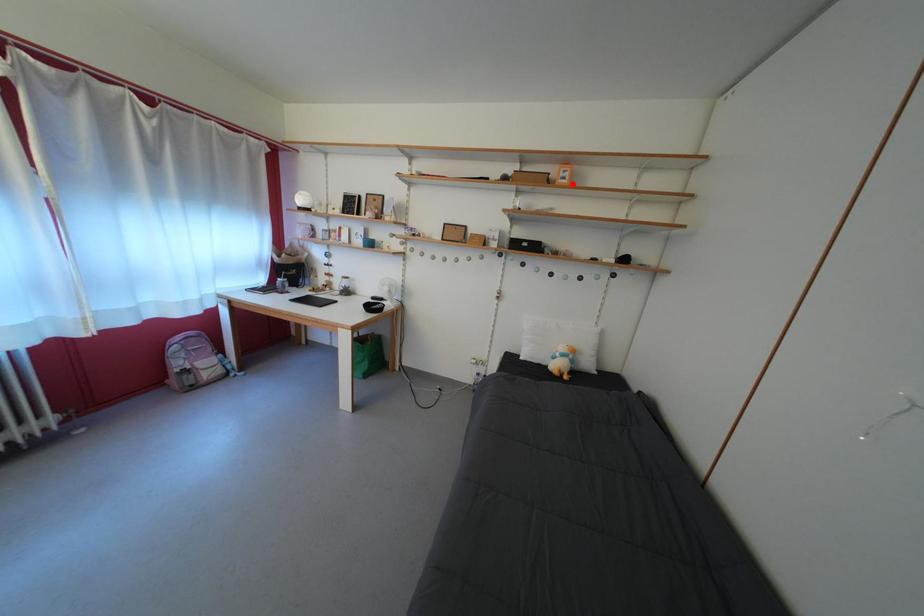
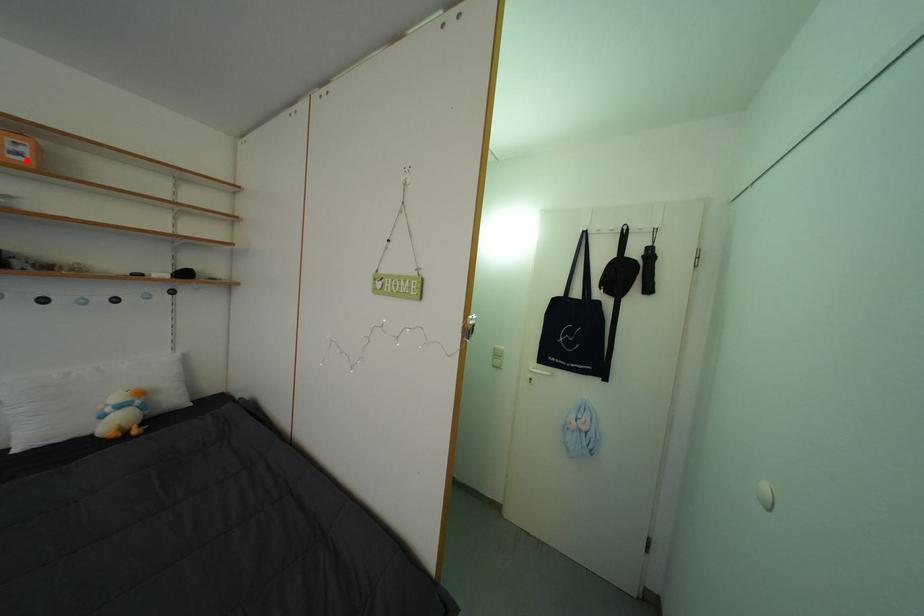
I am providing you with two images of the same scene from different viewpoints. A red point is marked on the first image and another point is marked on the second image. Is the marked point in image1 the same physical position as the marked point in image2?

Yes